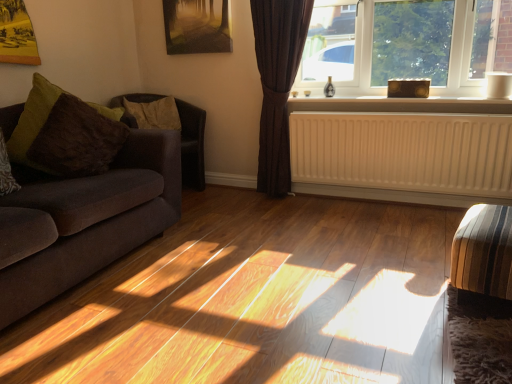
Question: From a real-world perspective, is wooden textured picture frame at upper center physically located above or below striped fabric armchair at lower right, the 1th armchair positioned from the front?

Choices:
 (A) below
 (B) above

Answer: (B)

Question: Relative to striped fabric armchair at lower right, which is the second armchair in top-to-bottom order, is wooden textured picture frame at upper center in front or behind?

Choices:
 (A) front
 (B) behind

Answer: (B)

Question: Which object is positioned farthest from the wooden textured picture frame at upper center?

Choices:
 (A) wooden floor at center
 (B) white painted wood at upper center
 (C) velvet dark brown couch at left
 (D) brown textured pillow at left, which appears as the second pillow when viewed from the front
 (E) striped fabric armchair at lower right, the second armchair from the back

Answer: (E)

Question: Estimate the real-world distances between objects in this image. Which object is closer to the brown fuzzy pillow at left, which ranks as the first pillow in front-to-back order?

Choices:
 (A) brown textured pillow at left, which appears as the second pillow when viewed from the front
 (B) white matte radiator at lower center
 (C) velvet dark brown couch at left
 (D) striped fabric armchair at lower right, acting as the 1th armchair starting from the bottom
 (E) matte brown window at upper right

Answer: (C)